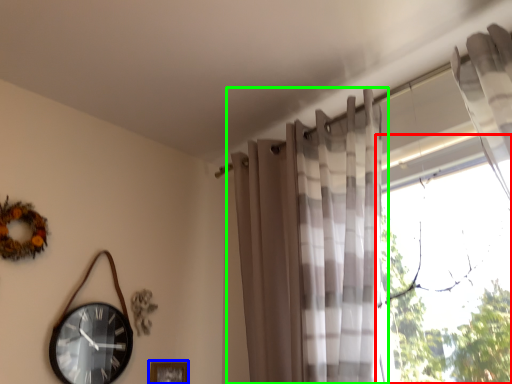
Question: Which object is the closest to the window (highlighted by a red box)? Choose among these: picture frame (highlighted by a blue box) or curtain (highlighted by a green box).

Choices:
 (A) picture frame
 (B) curtain

Answer: (B)